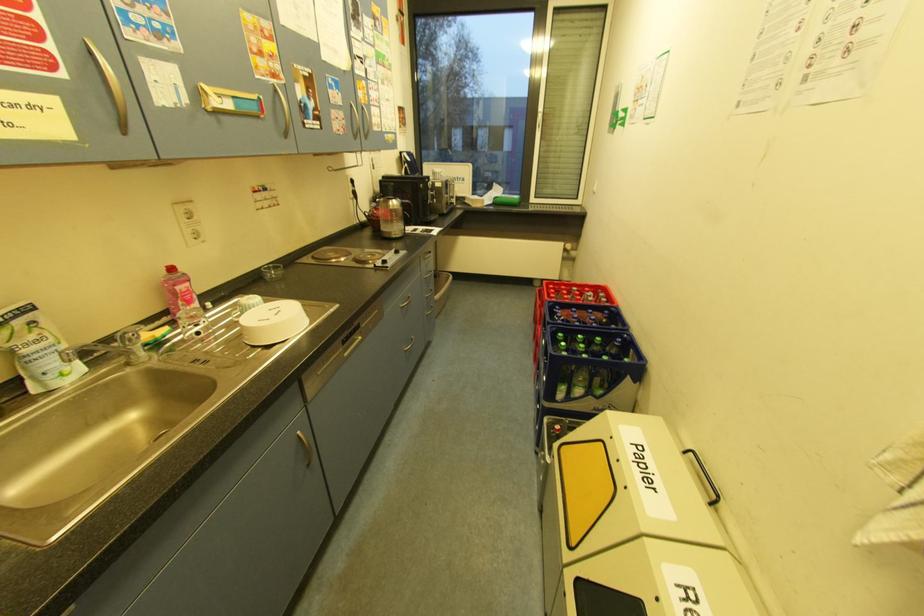
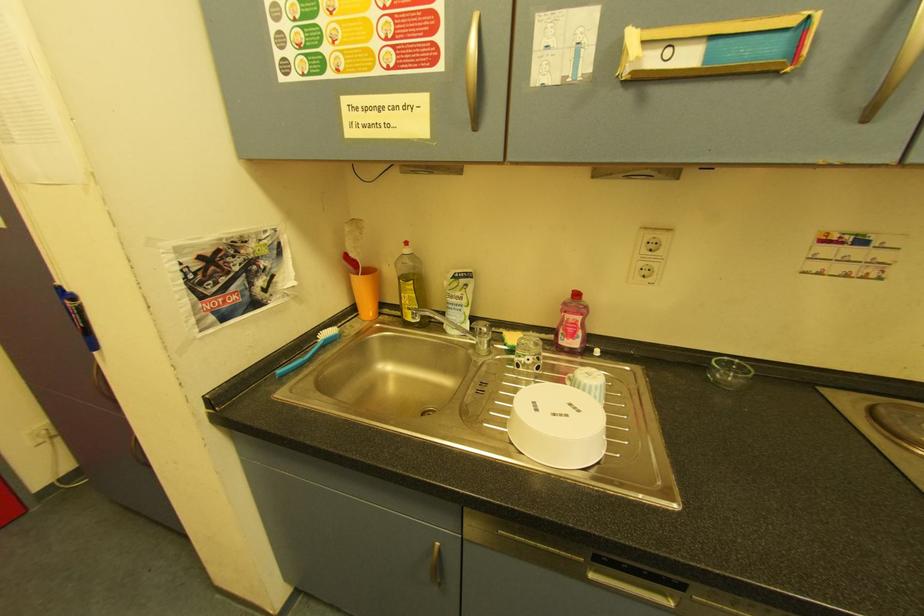
Based on the photo, based on the continuous images, in which direction is the camera rotating?

The rotation direction of the camera is left-down.